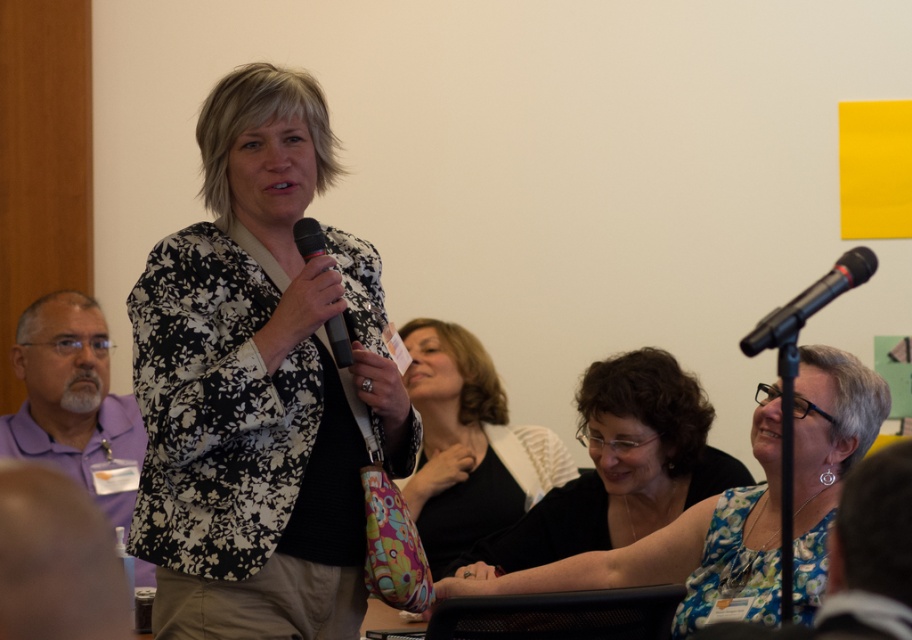
You are attending a virtual meeting and need to locate the speaker. Which object at point [807,304] is the microphone the speaker is using?

The black metallic microphone at upper right is located at point [807,304], which is the one the speaker is using.

You are organizing an event and need to place a 24 inch wide banner between the black metallic microphone at upper right and the black matte microphone at center. Can you fit it there?

The distance between the black metallic microphone at upper right and the black matte microphone at center is 33.90 inches. Since the banner is 24 inches wide, it can fit within the available space as 24 is less than 33.90.

You are organizing a small event and need to set up a stage for a speaker. The speaker will use the black matte microphone at center. However, there is a black jersey at center that is currently in the way. Can the microphone be placed on the jersey without it falling off?

The black jersey at center has a greater height compared to the black matte microphone at center. Since the jersey is taller, placing the microphone on it might cause instability and the microphone could fall off.